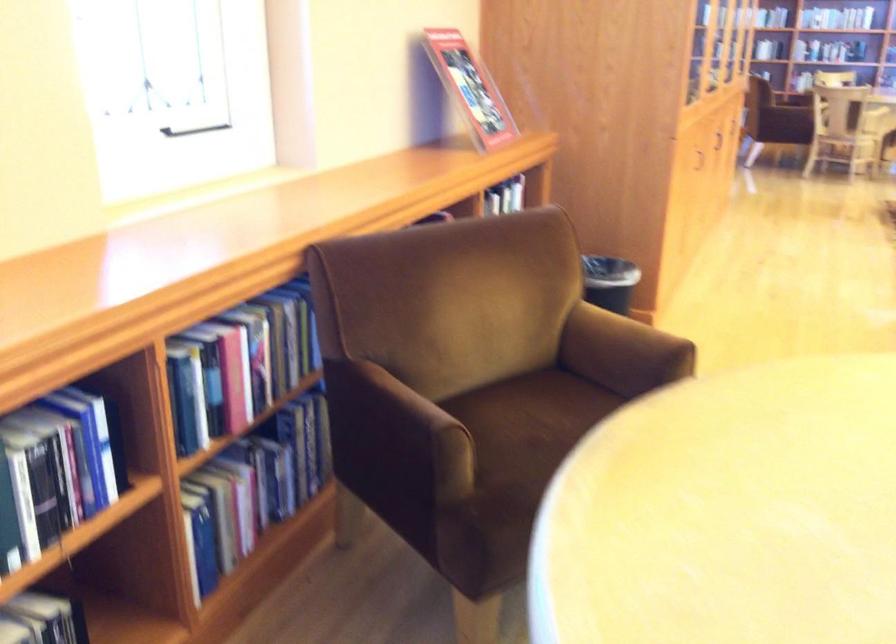
Find the location of a particular element. This screenshot has height=644, width=896. red book is located at coordinates (234, 375).